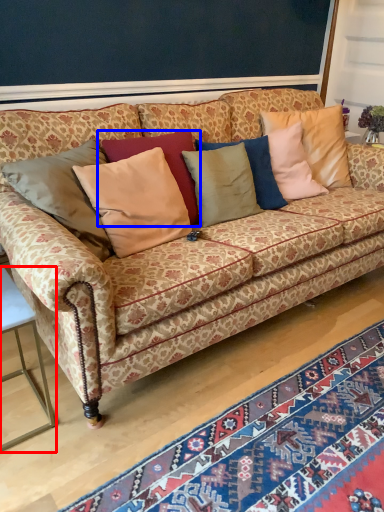
Question: Which of the following is the closest to the observer, table (highlighted by a red box) or pillow (highlighted by a blue box)?

Choices:
 (A) table
 (B) pillow

Answer: (A)